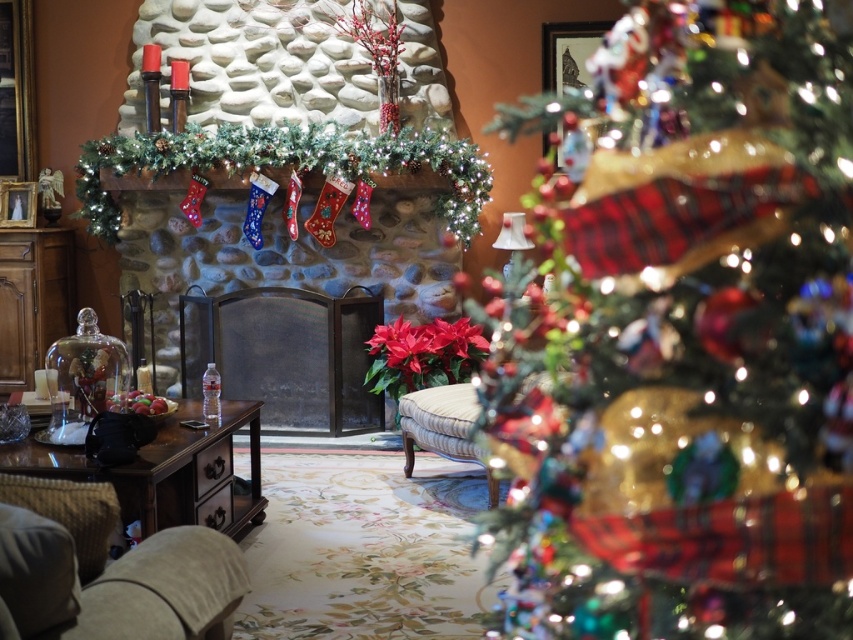
Is metallic fireplace screen at center closer to the viewer compared to beige fabric armchair at lower left?

No, metallic fireplace screen at center is behind beige fabric armchair at lower left.

Does metallic fireplace screen at center appear on the left side of beige fabric armchair at lower left?

Yes, metallic fireplace screen at center is to the left of beige fabric armchair at lower left.

The width and height of the screenshot is (853, 640). Identify the location of metallic fireplace screen at center. (283, 285).

Does metallic fireplace screen at center appear on the left side of red matte poinsettia at center?

Yes, metallic fireplace screen at center is to the left of red matte poinsettia at center.

You are a GUI agent. You are given a task and a screenshot of the screen. Output one action in this format:
    pyautogui.click(x=<x>, y=<y>)
    Task: Click on the metallic fireplace screen at center
    
    Given the screenshot: What is the action you would take?
    pyautogui.click(x=283, y=285)

Find the location of a particular element. The height and width of the screenshot is (640, 853). metallic fireplace screen at center is located at coordinates (283, 285).

Can you confirm if beige fabric armchair at lower left is taller than red matte poinsettia at center?

In fact, beige fabric armchair at lower left may be shorter than red matte poinsettia at center.

Does point (68, 608) come farther from viewer compared to point (395, 384)?

No, it is not.

In order to click on beige fabric armchair at lower left in this screenshot , I will do `click(114, 582)`.